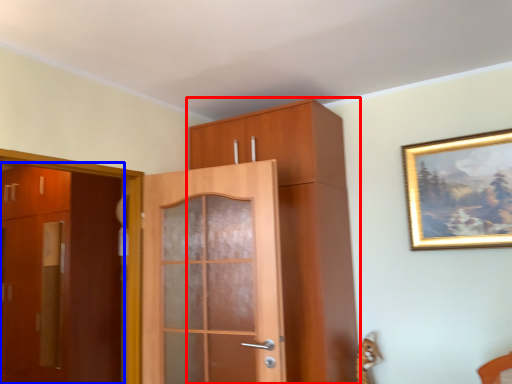
Question: Which object is further to the camera taking this photo, cabinetry (highlighted by a red box) or door (highlighted by a blue box)?

Choices:
 (A) cabinetry
 (B) door

Answer: (B)